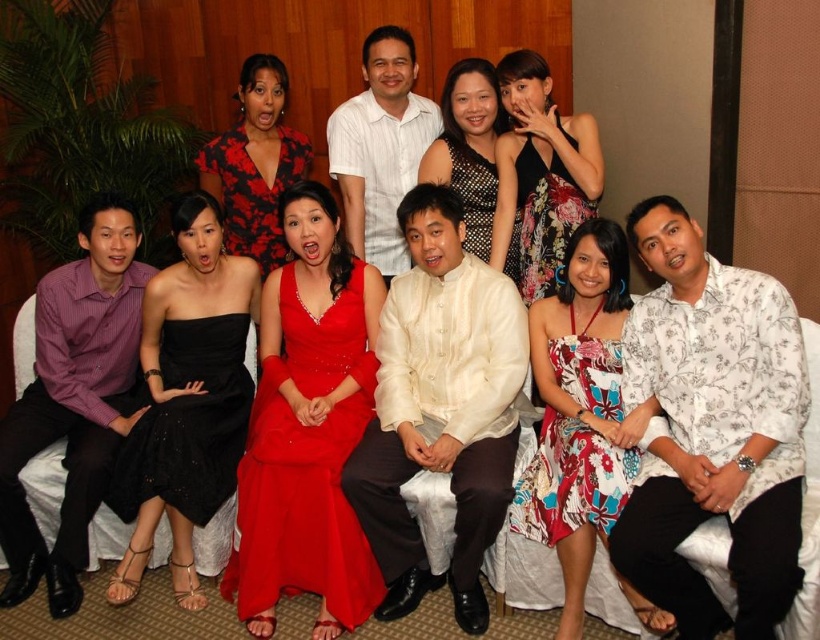
Does point (205, 234) lie behind point (518, 518)?

Yes, it is.

Who is more forward, (162, 339) or (634, 602)?

Point (634, 602)

Between point (153, 330) and point (563, 314), which one is positioned in front?

Point (563, 314) is in front.

Where is `black satin dress at left`? black satin dress at left is located at coordinates coord(185,400).

Which is in front, point (116, 209) or point (512, 138)?

Point (116, 209) is more forward.

The height and width of the screenshot is (640, 820). I want to click on purple striped shirt at left, so click(x=74, y=400).

Does floral dress at upper center appear over floral print dress at upper center?

Correct, floral dress at upper center is located above floral print dress at upper center.

What do you see at coordinates (541, 173) in the screenshot?
I see `floral dress at upper center` at bounding box center [541, 173].

Does point (511, 228) come in front of point (570, 176)?

No, (511, 228) is further to viewer.

This screenshot has width=820, height=640. I want to click on floral dress at upper center, so click(541, 173).